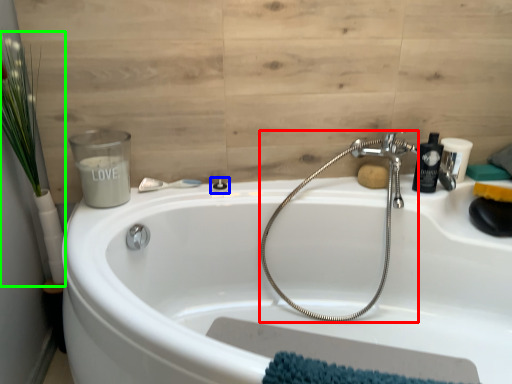
Question: Which is nearer to the plumbing fixture (highlighted by a red box)? shower (highlighted by a blue box) or plant (highlighted by a green box).

Choices:
 (A) shower
 (B) plant

Answer: (A)